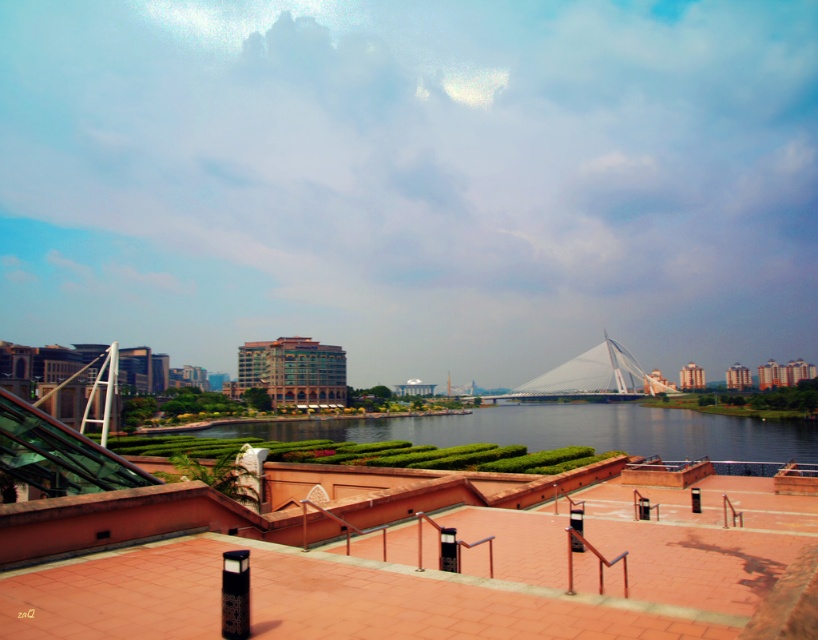
Can you confirm if green grassy river at center is shorter than white glass bridge at center?

Yes, green grassy river at center is shorter than white glass bridge at center.

Is green grassy river at center wider than white glass bridge at center?

Correct, the width of green grassy river at center exceeds that of white glass bridge at center.

Is point (564, 429) positioned in front of point (533, 381)?

Yes, point (564, 429) is in front of point (533, 381).

Where is `green grassy river at center`? This screenshot has height=640, width=818. green grassy river at center is located at coordinates (569, 429).